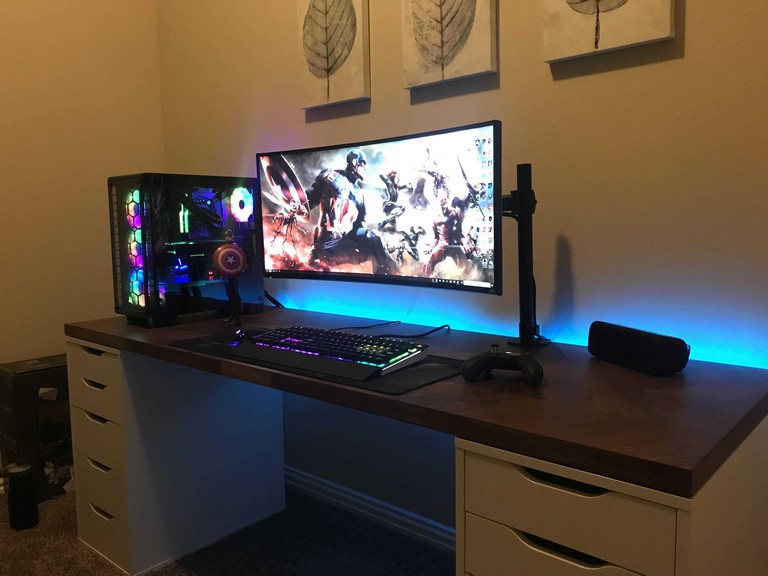
Identify the location of upper corner of the room on the left side. This screenshot has height=576, width=768. (164, 32).